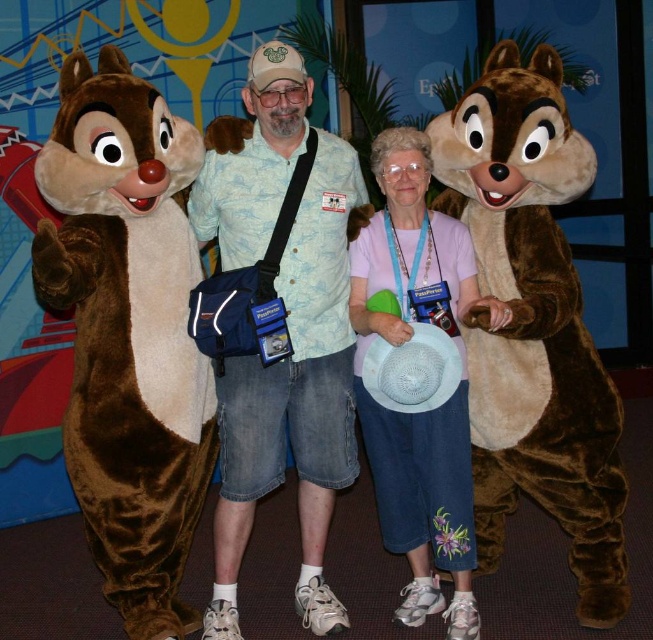
You are a guest at the Disney event and want to take a photo with both the fuzzy brown chipmunk at right and the velvety brown costume at center. Which one should you stand closer to if you want both to appear the same size in your photo?

Since the fuzzy brown chipmunk at right is larger than the velvety brown costume at center, you should stand closer to the velvety brown costume at center to make them appear the same size in the photo.

You are standing in front of the Disney event backdrop and see two points marked in the image. Which point, point 1 at coordinates (486, 376) or point 2 at coordinates (453, 460), is closer to you?

Point 1 at coordinates (486, 376) is closer to you because it is further to the viewer than point 2 at coordinates (453, 460).

You are a photographer at the Disney event. You need to capture a photo of both the fuzzy brown chipmunk at right and the velvety brown costume at center. Based on their positions, which one is higher up in the frame?

The fuzzy brown chipmunk at right is located above the velvety brown costume at center, so it is higher up in the frame.